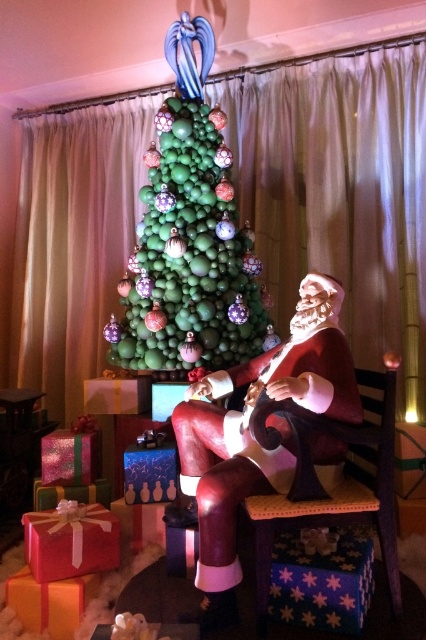
You are a child who wants to reach both the green matte ornaments at center and the shiny red gift at lower left. Which one do you need to stretch more to reach?

The green matte ornaments at center has a greater height compared to the shiny red gift at lower left, so you would need to stretch more to reach the green matte ornaments at center.

You are an interior designer planning to place a new red star decoration on the Christmas tree. The current tree has green matte ornaments at center. Where should you place the new red star decoration to maintain visual balance?

Place the red star decoration at the top of the Christmas tree to balance the green matte ornaments at center.